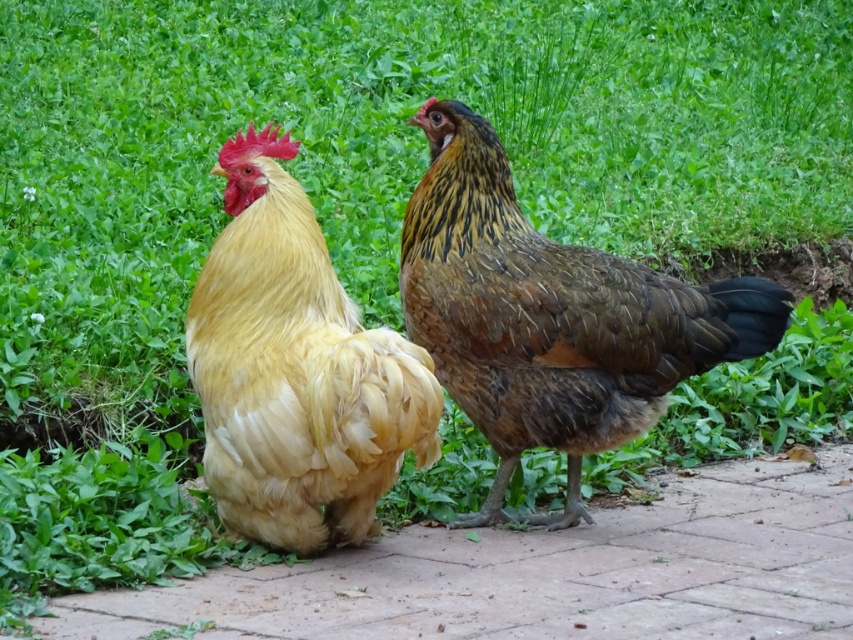
Question: Does brick pavement at lower center appear over brown speckled feathered chicken at center?

Choices:
 (A) no
 (B) yes

Answer: (A)

Question: Which object is positioned closest to the golden feathered rooster at center?

Choices:
 (A) brick pavement at lower center
 (B) brown speckled feathered chicken at center

Answer: (B)

Question: Does brown speckled feathered chicken at center have a greater width compared to golden feathered rooster at center?

Choices:
 (A) no
 (B) yes

Answer: (B)

Question: Estimate the real-world distances between objects in this image. Which object is closer to the brown speckled feathered chicken at center?

Choices:
 (A) golden feathered rooster at center
 (B) brick pavement at lower center

Answer: (A)

Question: Is brick pavement at lower center wider than brown speckled feathered chicken at center?

Choices:
 (A) yes
 (B) no

Answer: (A)

Question: Among these points, which one is nearest to the camera?

Choices:
 (A) (743, 627)
 (B) (734, 333)

Answer: (A)